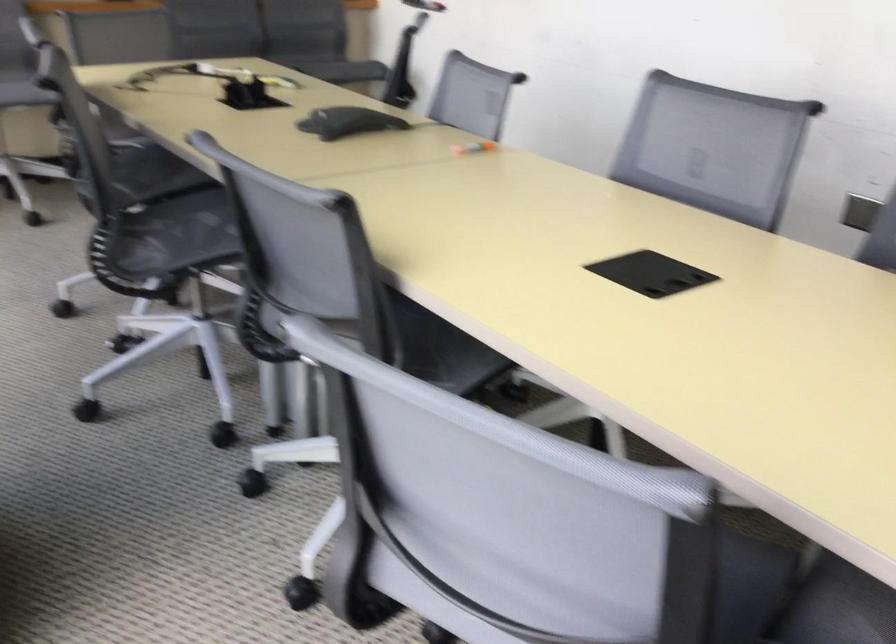
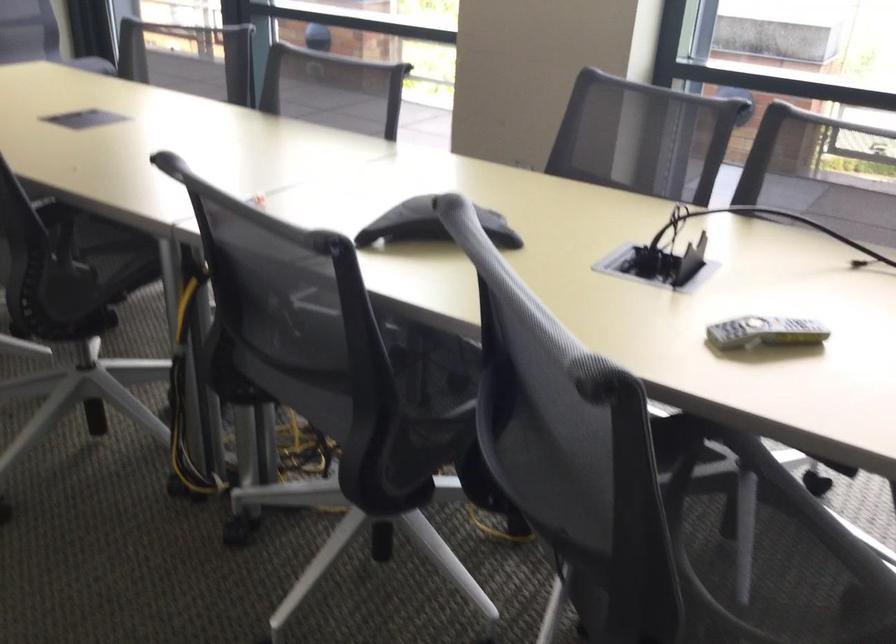
In the second image, find the point that corresponds to pixel 269 84 in the first image.

(764, 332)